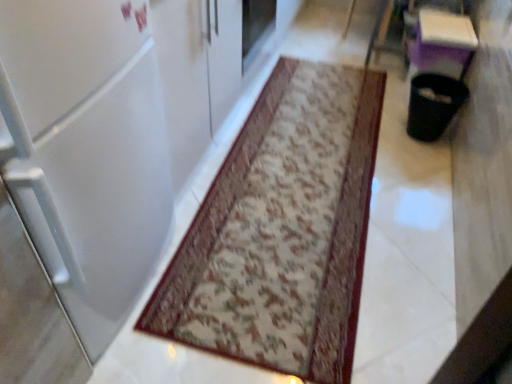
Question: Is floral carpet at center outside of white glossy refrigerator at center?

Choices:
 (A) no
 (B) yes

Answer: (B)

Question: Is floral carpet at center closer to the viewer compared to white glossy refrigerator at center?

Choices:
 (A) yes
 (B) no

Answer: (B)

Question: Is floral carpet at center thinner than white glossy refrigerator at center?

Choices:
 (A) yes
 (B) no

Answer: (B)

Question: Does floral carpet at center lie behind white glossy refrigerator at center?

Choices:
 (A) yes
 (B) no

Answer: (A)

Question: Is floral carpet at center facing away from white glossy refrigerator at center?

Choices:
 (A) no
 (B) yes

Answer: (A)

Question: Considering the relative positions of floral carpet at center and white glossy refrigerator at center in the image provided, is floral carpet at center to the right of white glossy refrigerator at center from the viewer's perspective?

Choices:
 (A) no
 (B) yes

Answer: (B)

Question: Does white glossy refrigerator at center have a larger size compared to floral carpet at center?

Choices:
 (A) no
 (B) yes

Answer: (B)

Question: Is white glossy refrigerator at center taller than floral carpet at center?

Choices:
 (A) no
 (B) yes

Answer: (B)

Question: Does white glossy refrigerator at center have a smaller size compared to floral carpet at center?

Choices:
 (A) yes
 (B) no

Answer: (B)

Question: Is white glossy refrigerator at center next to floral carpet at center and touching it?

Choices:
 (A) yes
 (B) no

Answer: (B)

Question: Does white glossy refrigerator at center lie behind floral carpet at center?

Choices:
 (A) no
 (B) yes

Answer: (A)

Question: Can you confirm if white glossy refrigerator at center is wider than floral carpet at center?

Choices:
 (A) no
 (B) yes

Answer: (A)

Question: From the image's perspective, is white glossy refrigerator at center positioned above or below floral carpet at center?

Choices:
 (A) above
 (B) below

Answer: (A)